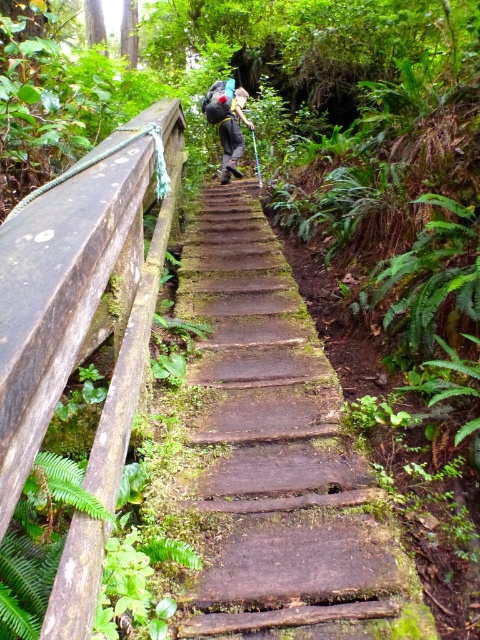
You are a hiker who wants to secure your matte black backpack at center to the brown weathered wood at left using a rope. Can you do this by tying the backpack directly to the wood?

The brown weathered wood at left is below the matte black backpack at center, so you can tie the backpack to the wood since they are positioned vertically in a way that allows the rope to connect them.

You are a hiker carrying a backpack and need to cross the mossy wood stairs at center and the brown weathered wood at left. The backpack has a strap that is 60 centimeters long. Can you safely attach the strap to both objects without stretching it?

The mossy wood stairs at center is 68.20 centimeters from brown weathered wood at left. Since the backpack strap is only 60 centimeters long, it is not long enough to reach between the two objects without stretching.

You are a hiker carrying a backpack and need to climb the mossy wood stairs at center. The stairs are 1.42 meters away from you. Your backpack has a length of 0.8 meters. Can you safely climb the stairs without the backpack hitting the stairs?

The mossy wood stairs at center are 1.42 meters away from the camera. Since your backpack is only 0.8 meters long, it will not reach the stairs when you climb. Therefore, you can safely climb the mossy wood stairs at center without the backpack hitting the stairs.